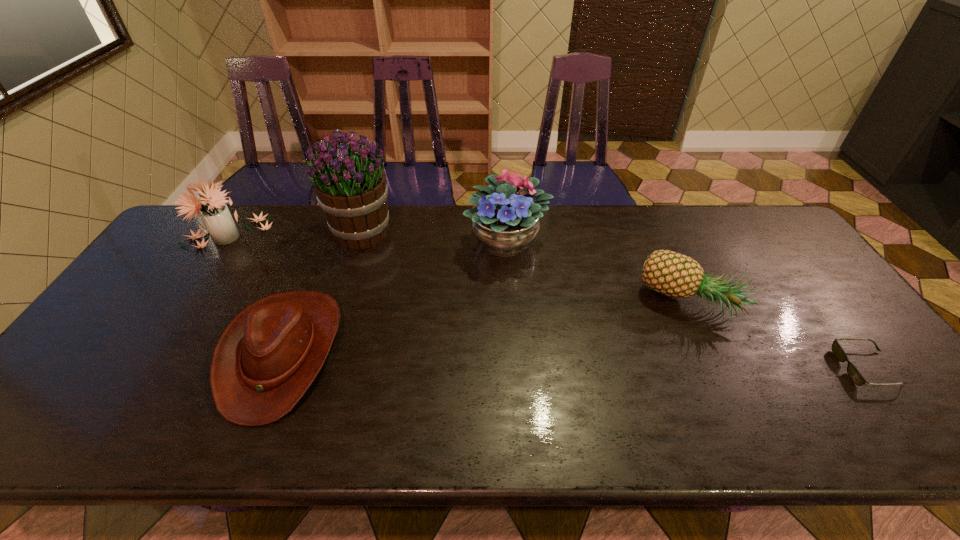
Find the location of `the tallest bouquet`. the tallest bouquet is located at coordinates (348, 178).

Locate an element on the screen. the tallest object is located at coordinates (348, 178).

This screenshot has width=960, height=540. Identify the location of the fourth object from left to right. (505, 223).

What are the coordinates of `the leftmost bouquet` in the screenshot? It's located at (216, 216).

Locate an element on the screen. pineapple is located at coordinates (673, 274).

Image resolution: width=960 pixels, height=540 pixels. I want to click on the fifth object from left to right, so click(673, 274).

Locate an element on the screen. The height and width of the screenshot is (540, 960). the fifth tallest object is located at coordinates (265, 360).

You are a GUI agent. You are given a task and a screenshot of the screen. Output one action in this format:
    pyautogui.click(x=<x>, y=<y>)
    Task: Click on the shortest object
    Image resolution: width=960 pixels, height=540 pixels.
    Given the screenshot: What is the action you would take?
    pyautogui.click(x=855, y=375)

Where is `the rightmost object`? the rightmost object is located at coordinates (855, 375).

Locate an element on the screen. vacant position located on the left of the second bouquet from right to left is located at coordinates [x=271, y=231].